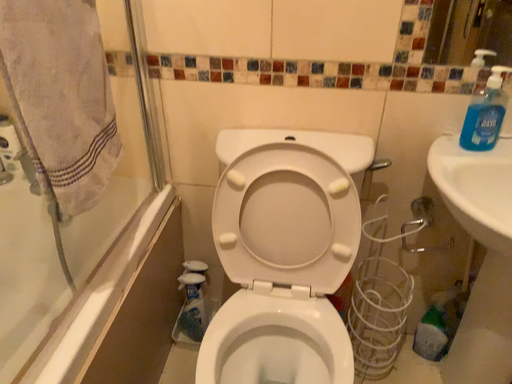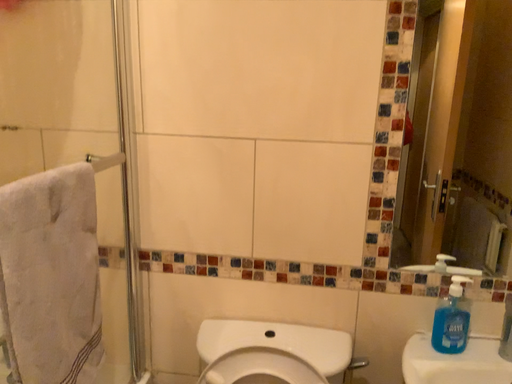
Question: How did the camera likely rotate when shooting the video?

Choices:
 (A) rotated downward
 (B) rotated upward

Answer: (B)